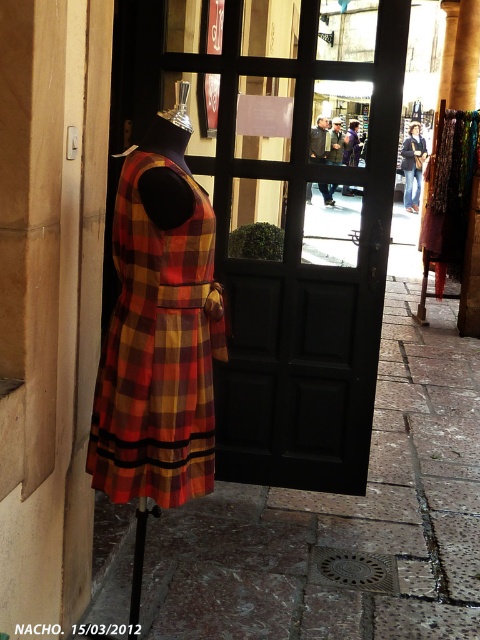
Consider the image. Can you confirm if plaid fabric dress at left is positioned above leather jacket at center?

Actually, plaid fabric dress at left is below leather jacket at center.

Consider the image. Does plaid fabric dress at left appear on the right side of leather jacket at center?

Incorrect, plaid fabric dress at left is not on the right side of leather jacket at center.

Is point (188, 378) positioned after point (332, 204)?

No, it is in front of (332, 204).

The image size is (480, 640). I want to click on plaid fabric dress at left, so click(x=156, y=353).

Is denim jacket at center to the right of leather jacket at center from the viewer's perspective?

Correct, you'll find denim jacket at center to the right of leather jacket at center.

Find the location of a particular element. The width and height of the screenshot is (480, 640). denim jacket at center is located at coordinates (412, 164).

Is marble pavement at center positioned before plaid fabric dress at left?

No, it is behind plaid fabric dress at left.

Does marble pavement at center appear on the right side of plaid fabric dress at left?

Correct, you'll find marble pavement at center to the right of plaid fabric dress at left.

Does point (272, 515) come behind point (122, 426)?

Yes, it is behind point (122, 426).

The height and width of the screenshot is (640, 480). What are the coordinates of `marble pavement at center` in the screenshot? It's located at (345, 518).